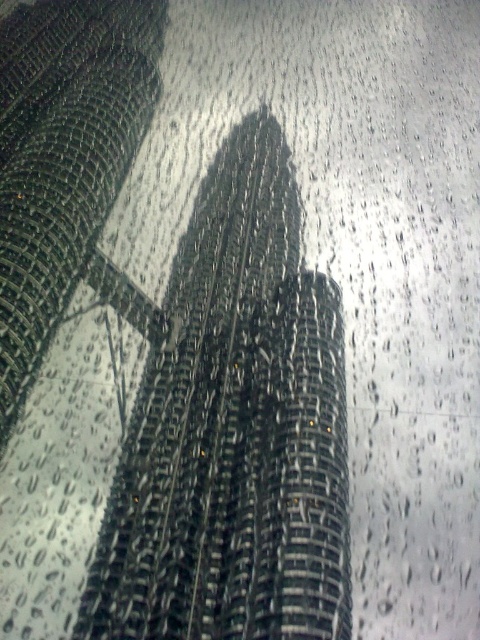
Question: Is reflective glass tower at center bigger than metallic grid tower at center?

Choices:
 (A) no
 (B) yes

Answer: (A)

Question: Is reflective glass tower at center to the left of metallic grid tower at center from the viewer's perspective?

Choices:
 (A) yes
 (B) no

Answer: (B)

Question: Among these objects, which one is nearest to the camera?

Choices:
 (A) metallic grid tower at center
 (B) reflective glass tower at center

Answer: (B)

Question: Which of the following is the closest to the observer?

Choices:
 (A) (39, 212)
 (B) (256, 243)

Answer: (A)

Question: In this image, where is reflective glass tower at center located relative to metallic grid tower at center?

Choices:
 (A) right
 (B) left

Answer: (A)